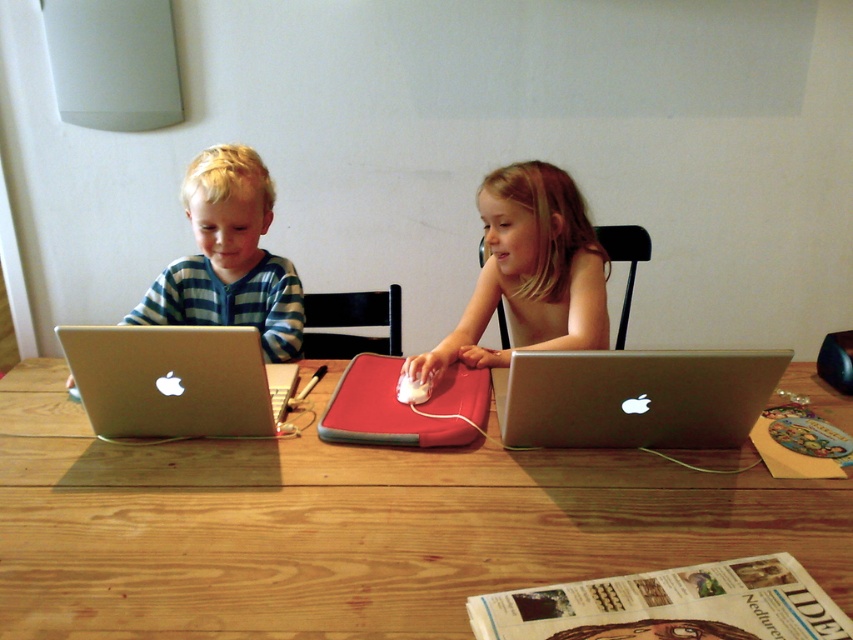
Question: Does silver metallic laptop at center have a smaller size compared to smooth skin girl at center?

Choices:
 (A) no
 (B) yes

Answer: (B)

Question: Considering the relative positions of wooden table at center and matte silver laptop at left in the image provided, where is wooden table at center located with respect to matte silver laptop at left?

Choices:
 (A) above
 (B) below

Answer: (B)

Question: Among these points, which one is farthest from the camera?

Choices:
 (A) (601, 323)
 (B) (381, 634)
 (C) (196, 266)

Answer: (C)

Question: Does silver metallic laptop at center appear on the right side of smooth skin girl at center?

Choices:
 (A) no
 (B) yes

Answer: (B)

Question: Which of the following is the closest to the observer?

Choices:
 (A) 76,362
 (B) 503,289

Answer: (A)

Question: Which is nearer to the matte silver laptop at left?

Choices:
 (A) silver metallic laptop at left
 (B) wooden table at center

Answer: (A)